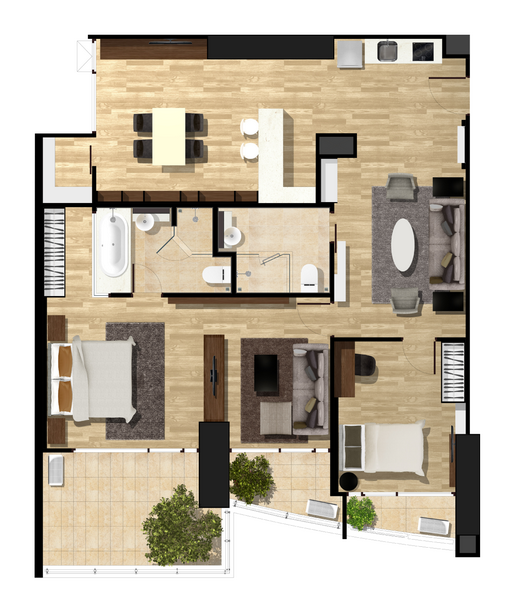
This screenshot has width=515, height=596. I want to click on rug, so click(153, 396).